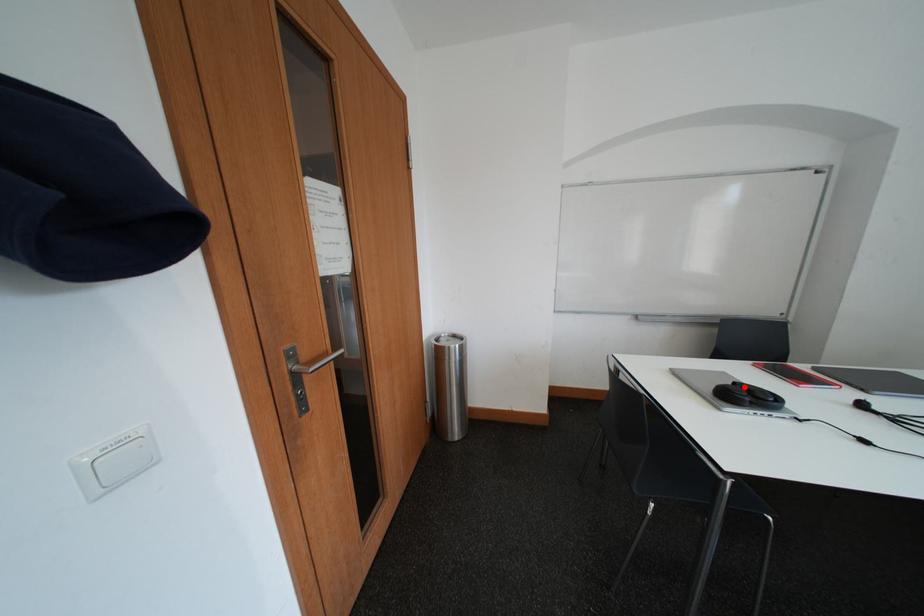
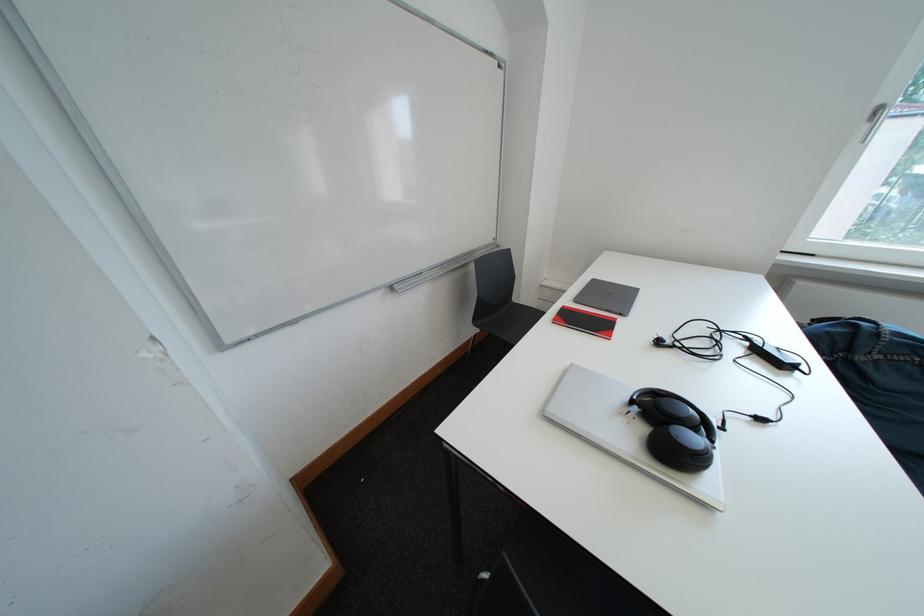
Where in the second image is the point corresponding to the highlighted location from the first image?

(642, 405)